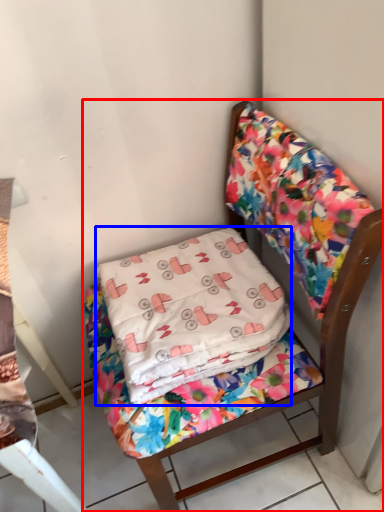
Question: Which object is closer to the camera taking this photo, chair (highlighted by a red box) or pillow (highlighted by a blue box)?

Choices:
 (A) chair
 (B) pillow

Answer: (A)